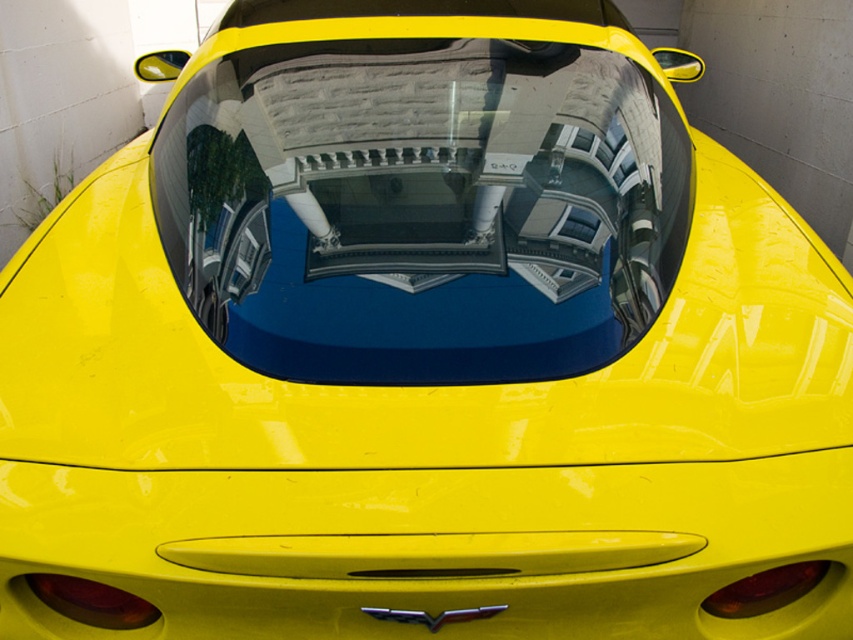
Describe the element at coordinates (422, 208) in the screenshot. I see `transparent glass windshield at center` at that location.

Which of these two, transparent glass windshield at center or white plastic license plate at center, stands shorter?

white plastic license plate at center is shorter.

Is point (474, 109) positioned behind point (508, 157)?

Yes, it is.

Find the location of a particular element. transparent glass windshield at center is located at coordinates (422, 208).